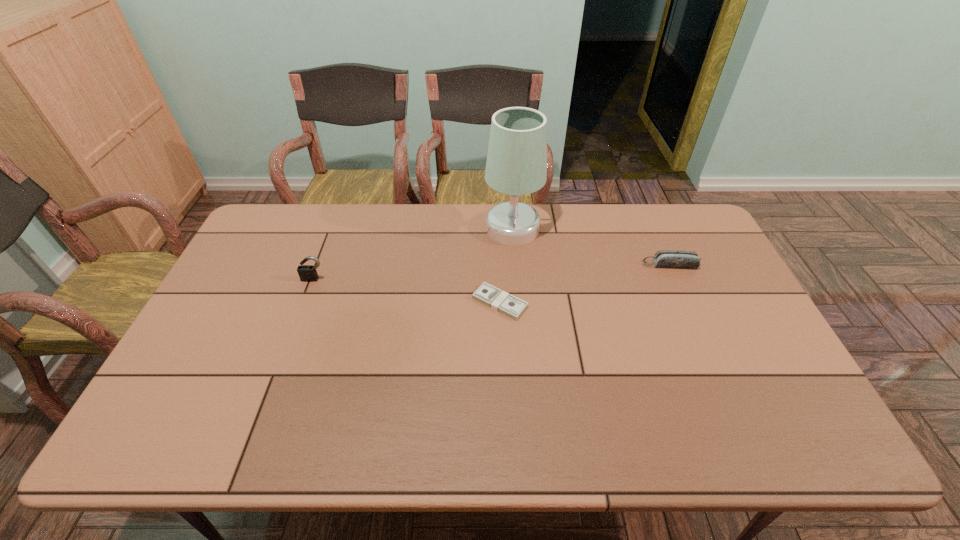
This screenshot has width=960, height=540. In order to click on free region that satisfies the following two spatial constraints: 1. on the base of the lampshade; 2. with the keyhole on the front of the second tallest object in this screenshot , I will do `click(516, 279)`.